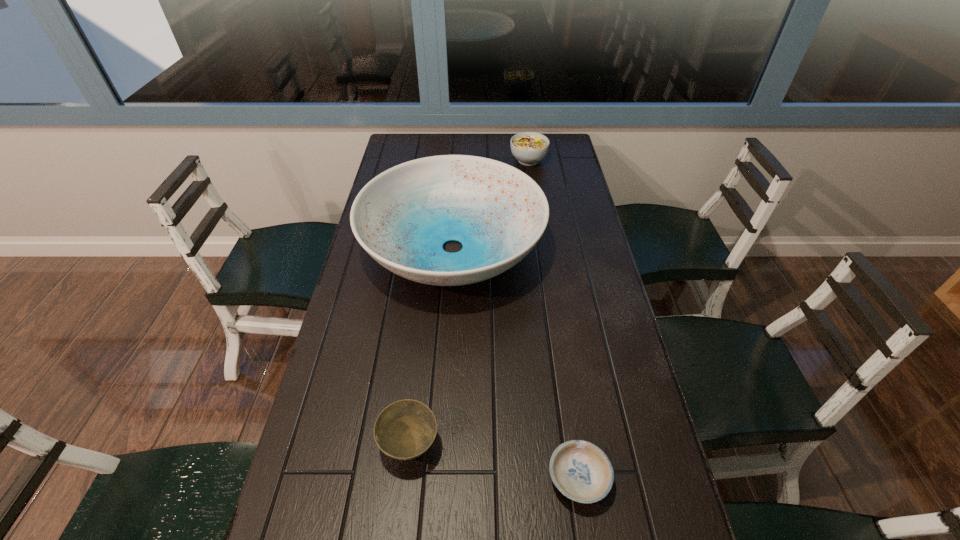
Where is `vacant region at the far right corner`? The height and width of the screenshot is (540, 960). vacant region at the far right corner is located at coordinates (547, 134).

Where is `empty space between the left bowl and the right bowl`? The height and width of the screenshot is (540, 960). empty space between the left bowl and the right bowl is located at coordinates (493, 462).

I want to click on free spot between the shortest object and the taller bowl, so click(493, 462).

The width and height of the screenshot is (960, 540). I want to click on vacant space that's between the taller bowl and the soup bowl, so click(469, 302).

At what (x,y) coordinates should I click in order to perform the action: click on free area in between the taller bowl and the tallest object. Please return your answer as a coordinate pair (x, y). The height and width of the screenshot is (540, 960). Looking at the image, I should click on (431, 346).

Locate an element on the screen. The image size is (960, 540). free point between the shorter bowl and the left bowl is located at coordinates (493, 462).

Find the location of `vacant space in between the taller bowl and the soup bowl`. vacant space in between the taller bowl and the soup bowl is located at coordinates (469, 302).

Locate an element on the screen. This screenshot has height=540, width=960. free space between the right bowl and the left bowl is located at coordinates (493, 462).

The image size is (960, 540). Identify the location of object that is the third closest to the left bowl. (529, 148).

The height and width of the screenshot is (540, 960). Identify the location of the third closest object relative to the soup bowl. (581, 471).